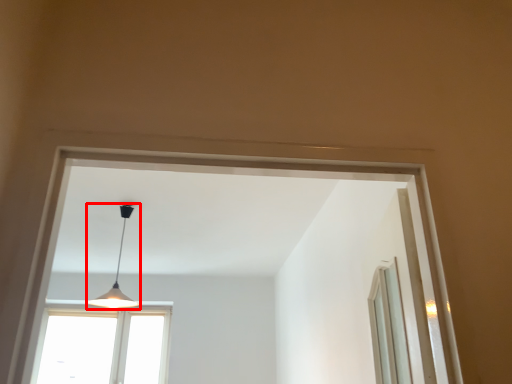
Question: From the image's perspective, where is lamp (annotated by the red box) located relative to window?

Choices:
 (A) below
 (B) above

Answer: (B)